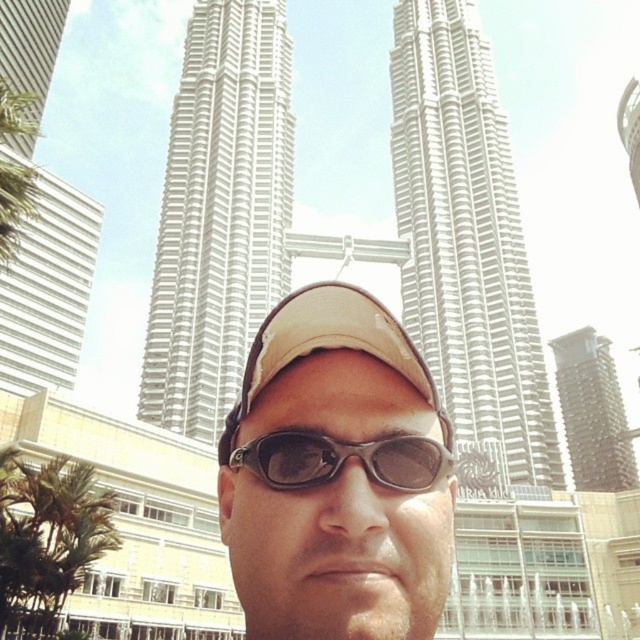
Consider the image. You are a photographer trying to capture both the white metallic tower at center and the white smooth building at left in a single shot. Based on their positions, which building should you frame first to ensure both are visible in the photo?

The white metallic tower at center is positioned on the right side of white smooth building at left, so you should frame the white smooth building at left first to ensure both are visible in the photo.

You are standing in the scene and want to take a photo of both point (227, 44) and point (257, 465) in the image. Which point should you focus on first to ensure both are in focus?

You should focus on point (227, 44) first because it is closer to the camera than point (257, 465). By focusing on the closer point, the farther point will also be within the depth of field, ensuring both are in focus.

Based on the coordinates provided, which object corresponds to the point at location [49,289]?

The point at location [49,289] corresponds to the white smooth building at left.